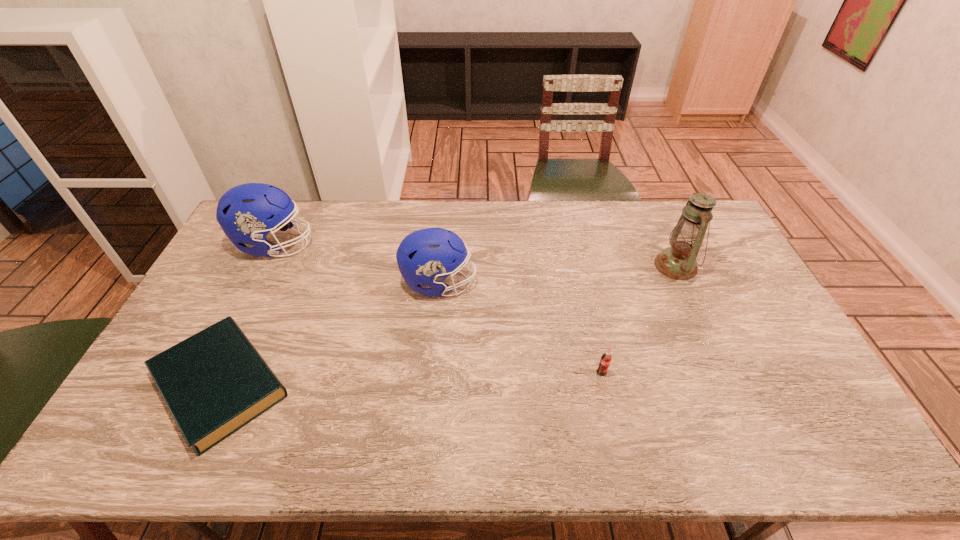
In the image, there is a desktop. Identify the location of vacant space at the far edge. This screenshot has width=960, height=540. (490, 207).

Where is `vacant space at the near edge`? This screenshot has height=540, width=960. vacant space at the near edge is located at coordinates (340, 446).

You are a GUI agent. You are given a task and a screenshot of the screen. Output one action in this format:
    pyautogui.click(x=<x>, y=<y>)
    Task: Click on the vacant space at the left edge
    The height and width of the screenshot is (540, 960).
    Given the screenshot: What is the action you would take?
    pyautogui.click(x=133, y=404)

Find the location of a particular element. This screenshot has height=540, width=960. vacant space at the right edge of the desktop is located at coordinates (758, 395).

In the image, there is a desktop. Where is `free space at the far right corner`? Image resolution: width=960 pixels, height=540 pixels. free space at the far right corner is located at coordinates click(670, 217).

Where is `empty space between the fourth object from left to right and the third object from right to left`? Image resolution: width=960 pixels, height=540 pixels. empty space between the fourth object from left to right and the third object from right to left is located at coordinates (520, 328).

The width and height of the screenshot is (960, 540). Identify the location of empty location between the left football helmet and the book. (248, 314).

Locate an element on the screen. This screenshot has height=540, width=960. free space between the third object from right to left and the soda bottle is located at coordinates (520, 328).

Where is `vacant area between the right football helmet and the second shortest object`? The image size is (960, 540). vacant area between the right football helmet and the second shortest object is located at coordinates (520, 328).

I want to click on vacant space that is in between the left football helmet and the oil lamp, so point(475,255).